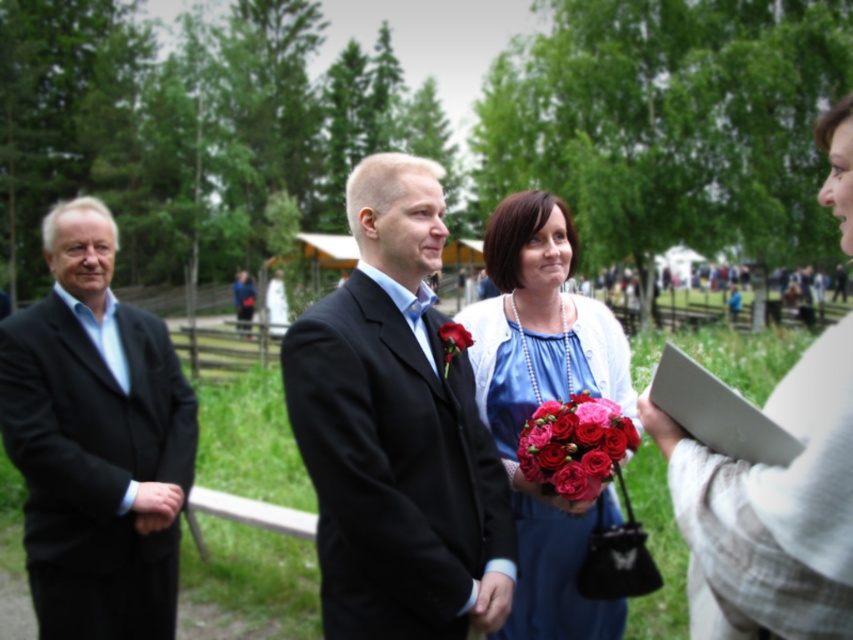
Question: Is blue satin dress at center to the left of smooth silk rose at center from the viewer's perspective?

Choices:
 (A) no
 (B) yes

Answer: (A)

Question: Which point is farther to the camera?

Choices:
 (A) (613, 422)
 (B) (453, 339)

Answer: (A)

Question: Which point is farther from the camera taking this photo?

Choices:
 (A) (80, 326)
 (B) (450, 332)
 (C) (550, 413)
 (D) (735, 580)

Answer: (A)

Question: Which is farther from the matte black suit at center?

Choices:
 (A) black matte suit at left
 (B) light beige sweater at right
 (C) shiny red roses at center

Answer: (A)

Question: Is light beige sweater at right behind blue satin dress at center?

Choices:
 (A) no
 (B) yes

Answer: (A)

Question: Does light beige sweater at right have a greater width compared to smooth silk rose at center?

Choices:
 (A) yes
 (B) no

Answer: (A)